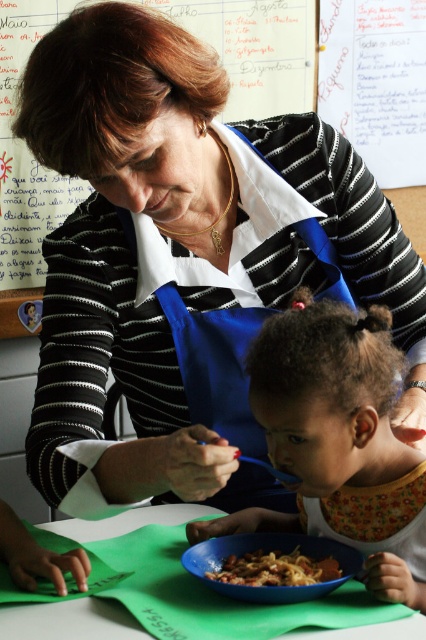
Who is shorter, white paper at upper center or green paper at lower center?

green paper at lower center

Where is `white paper at upper center`? white paper at upper center is located at coordinates (25, 172).

Where is `white paper at upper center`? white paper at upper center is located at coordinates (25, 172).

Is point (368, 584) farther from viewer compared to point (325, 566)?

That is False.

Is point (391, 376) positioned behind point (244, 566)?

No.

The width and height of the screenshot is (426, 640). In order to click on floral bib at lower center in this screenshot , I will do `click(337, 442)`.

Is green paper at lower center bigger than shiny plastic bowl at center?

Yes.

Based on the photo, does green paper at lower center appear over shiny plastic bowl at center?

Actually, green paper at lower center is below shiny plastic bowl at center.

You are a GUI agent. You are given a task and a screenshot of the screen. Output one action in this format:
    pyautogui.click(x=<x>, y=<y>)
    Task: Click on the green paper at lower center
    
    Given the screenshot: What is the action you would take?
    pyautogui.click(x=69, y=621)

At what (x,y) coordinates should I click in order to perform the action: click on green paper at lower center. Please return your answer as a coordinate pair (x, y). The image size is (426, 640). Looking at the image, I should click on (69, 621).